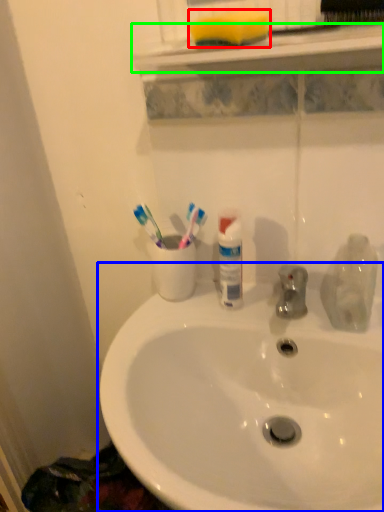
Question: Based on their relative distances, which object is farther from soap (highlighted by a red box)? Choose from sink (highlighted by a blue box) and window sill (highlighted by a green box).

Choices:
 (A) sink
 (B) window sill

Answer: (A)